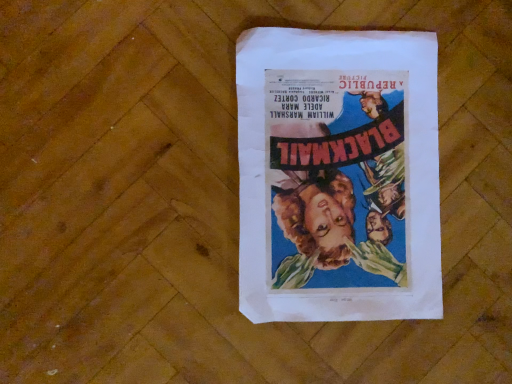
Where is `vintage paper poster at center`? vintage paper poster at center is located at coordinates (338, 175).

What do you see at coordinates (338, 175) in the screenshot?
I see `vintage paper poster at center` at bounding box center [338, 175].

What is the approximate height of vintage paper poster at center?

The height of vintage paper poster at center is 1.57 centimeters.

The width and height of the screenshot is (512, 384). Identify the location of vintage paper poster at center. (338, 175).